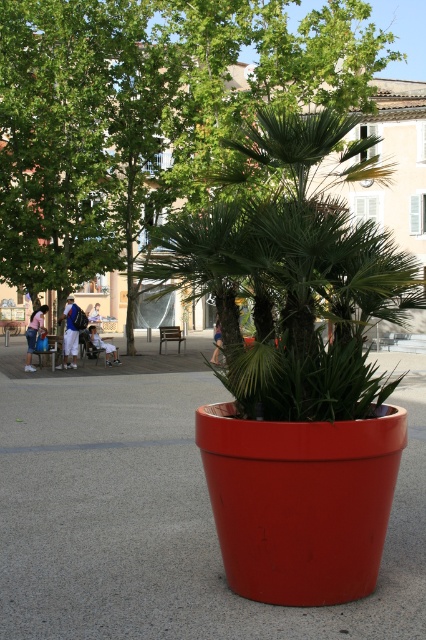
Is green leafy tree at center wider than denim shorts at left?

Indeed, green leafy tree at center has a greater width compared to denim shorts at left.

Where is `green leafy tree at center`? green leafy tree at center is located at coordinates (144, 115).

Is point (238, 120) in front of point (42, 321)?

Yes, point (238, 120) is closer to viewer.

Where is `green leafy tree at center`? Image resolution: width=426 pixels, height=640 pixels. green leafy tree at center is located at coordinates (144, 115).

Does denim jacket at left appear on the left side of light blue denim shorts at center?

Incorrect, denim jacket at left is not on the left side of light blue denim shorts at center.

Can you confirm if denim jacket at left is positioned below light blue denim shorts at center?

Indeed, denim jacket at left is positioned under light blue denim shorts at center.

Between point (69, 324) and point (100, 317), which one is positioned behind?

Point (100, 317)

Where is `denim jacket at left`? The image size is (426, 640). denim jacket at left is located at coordinates (69, 333).

Find the location of a particular element. This screenshot has height=640, width=426. white cotton shirt at center is located at coordinates (103, 346).

Does white cotton shirt at center have a larger size compared to light blue denim shorts at center?

Correct, white cotton shirt at center is larger in size than light blue denim shorts at center.

Does point (98, 337) come closer to viewer compared to point (94, 320)?

Yes, it is in front of point (94, 320).

Identify the location of white cotton shirt at center. This screenshot has height=640, width=426. (103, 346).